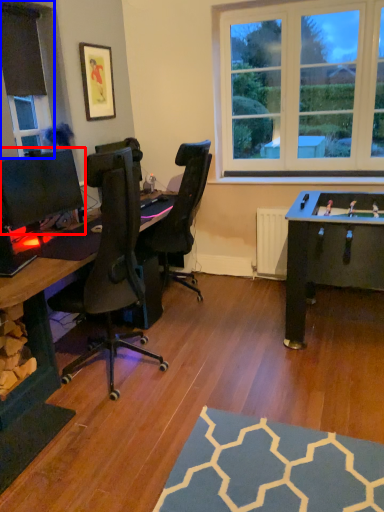
Question: Which object appears closest to the camera in this image, computer monitor (highlighted by a red box) or window frame (highlighted by a blue box)?

Choices:
 (A) computer monitor
 (B) window frame

Answer: (A)